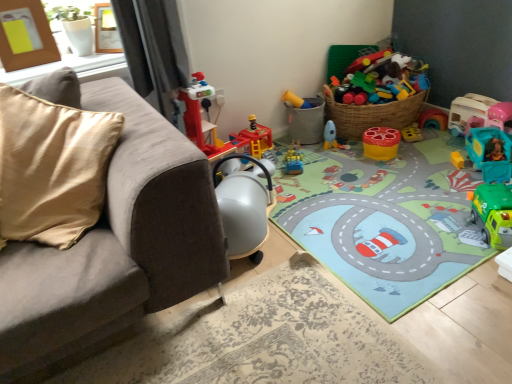
At what (x,y) coordinates should I click in order to perform the action: click on vacant area on the back side of shiny yellow plastic train at center, placed as the 6th toy when sorted from right to left. Please return your answer as a coordinate pair (x, y). Looking at the image, I should click on (296, 146).